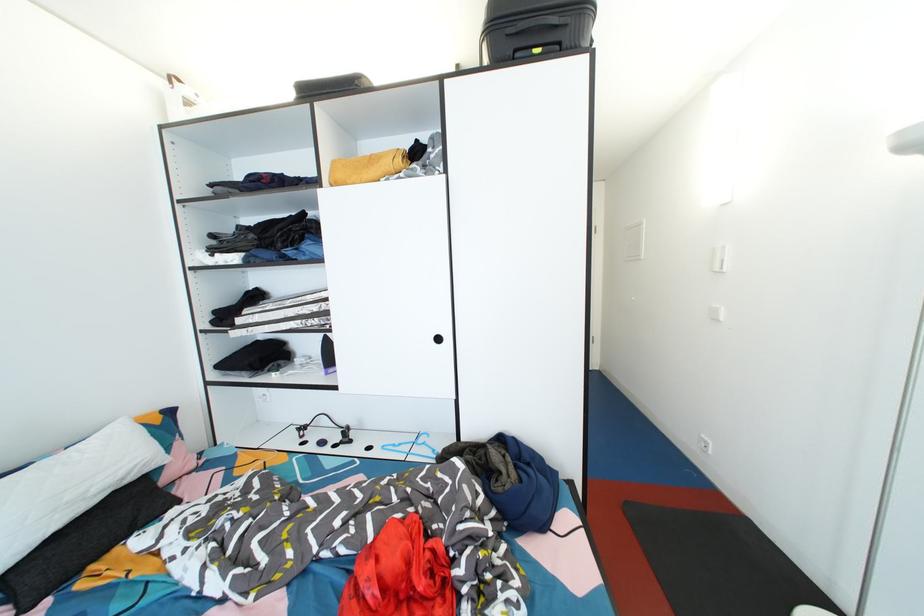
Where is `cabinet door handle`? cabinet door handle is located at coordinates (440, 339).